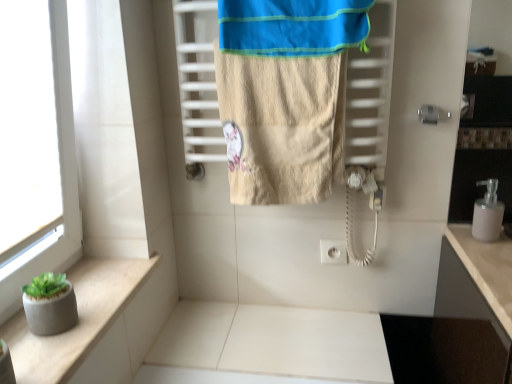
Question: Is beige textured towel at center oriented towards pink matte soap dispenser at right?

Choices:
 (A) no
 (B) yes

Answer: (A)

Question: Does beige textured towel at center come in front of pink matte soap dispenser at right?

Choices:
 (A) no
 (B) yes

Answer: (B)

Question: From a real-world perspective, is beige textured towel at center positioned under pink matte soap dispenser at right based on gravity?

Choices:
 (A) yes
 (B) no

Answer: (B)

Question: From the image's perspective, does beige textured towel at center appear lower than pink matte soap dispenser at right?

Choices:
 (A) yes
 (B) no

Answer: (B)

Question: Is beige textured towel at center positioned behind pink matte soap dispenser at right?

Choices:
 (A) yes
 (B) no

Answer: (B)

Question: From a real-world perspective, is beige textured towel at center on top of pink matte soap dispenser at right?

Choices:
 (A) yes
 (B) no

Answer: (A)

Question: From the image's perspective, would you say blue cotton beach towel at upper center is shown under beige textured towel at center?

Choices:
 (A) no
 (B) yes

Answer: (A)

Question: From a real-world perspective, does blue cotton beach towel at upper center sit lower than beige textured towel at center?

Choices:
 (A) yes
 (B) no

Answer: (B)

Question: Is blue cotton beach towel at upper center taller than beige textured towel at center?

Choices:
 (A) yes
 (B) no

Answer: (B)

Question: Considering the relative sizes of blue cotton beach towel at upper center and beige textured towel at center in the image provided, is blue cotton beach towel at upper center shorter than beige textured towel at center?

Choices:
 (A) no
 (B) yes

Answer: (B)

Question: Does blue cotton beach towel at upper center lie in front of beige textured towel at center?

Choices:
 (A) no
 (B) yes

Answer: (B)

Question: Is blue cotton beach towel at upper center positioned beyond the bounds of beige textured towel at center?

Choices:
 (A) no
 (B) yes

Answer: (B)

Question: Is pink matte soap dispenser at right far from beige textured towel at center?

Choices:
 (A) yes
 (B) no

Answer: (B)